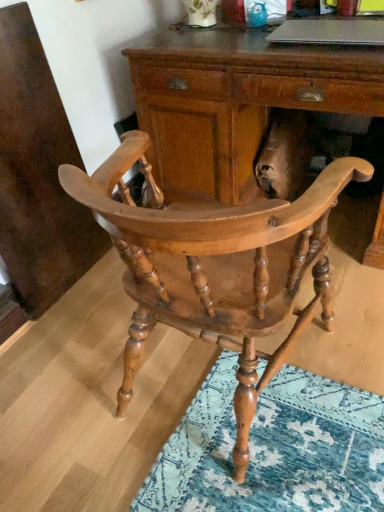
This screenshot has height=512, width=384. Find the location of `empty space that is ontop of wooden desk at center (from a real-world perspective)`. empty space that is ontop of wooden desk at center (from a real-world perspective) is located at coordinates (296, 28).